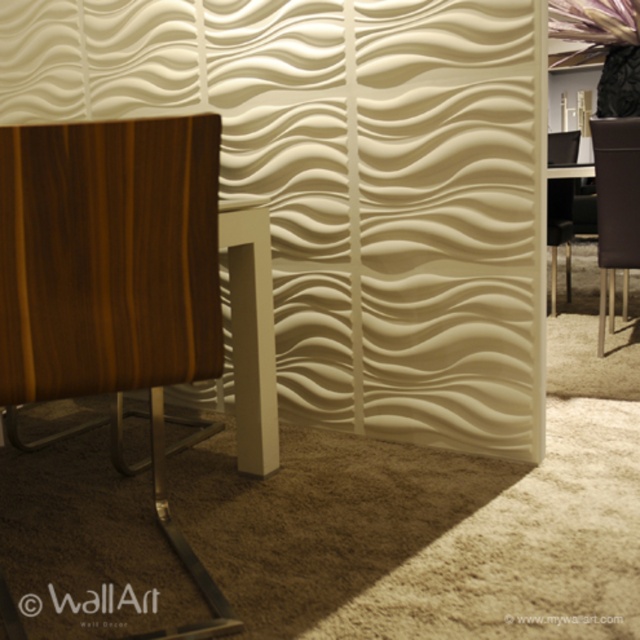
Does walnut wood swivel chair at left have a lesser width compared to black leather chair at right?

No, walnut wood swivel chair at left is not thinner than black leather chair at right.

Between point (61, 195) and point (563, 195), which one is positioned in front?

Point (61, 195) is in front.

I want to click on walnut wood swivel chair at left, so click(x=113, y=278).

Which is more to the left, walnut wood swivel chair at left or brown leather chair at right?

From the viewer's perspective, walnut wood swivel chair at left appears more on the left side.

Measure the distance between walnut wood swivel chair at left and camera.

walnut wood swivel chair at left is 1.21 meters away from camera.

Find the location of a particular element. This screenshot has width=640, height=640. walnut wood swivel chair at left is located at coordinates (113, 278).

Which of these two, brown leather chair at right or black leather chair at right, stands shorter?

Standing shorter between the two is black leather chair at right.

Looking at this image, between brown leather chair at right and black leather chair at right, which one is positioned higher?

black leather chair at right is above.

Locate an element on the screen. This screenshot has height=640, width=640. brown leather chair at right is located at coordinates pos(616,200).